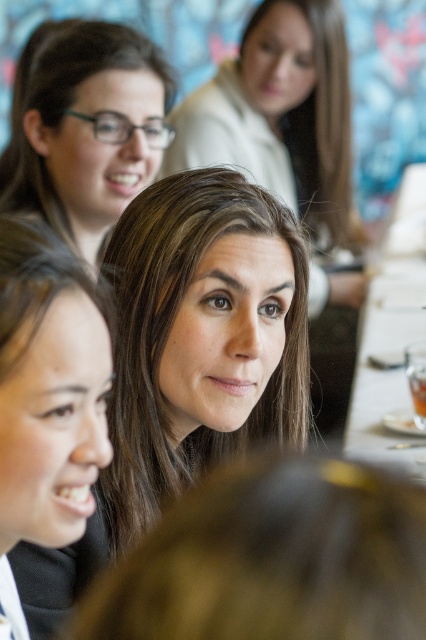
You are an observer at this gathering. You notice the matte black glasses at upper left and the smooth black hair at lower left. Which object is wider?

The matte black glasses at upper left is wider than the smooth black hair at lower left.

You are a photographer at this gathering and want to take a photo of the white porcelain table at center without including the matte black glasses at upper left in the frame. Is it possible to adjust your position to achieve this?

The matte black glasses at upper left is positioned on the left side of white porcelain table at center. By moving to the right side of the table, you can avoid including the glasses in the frame.